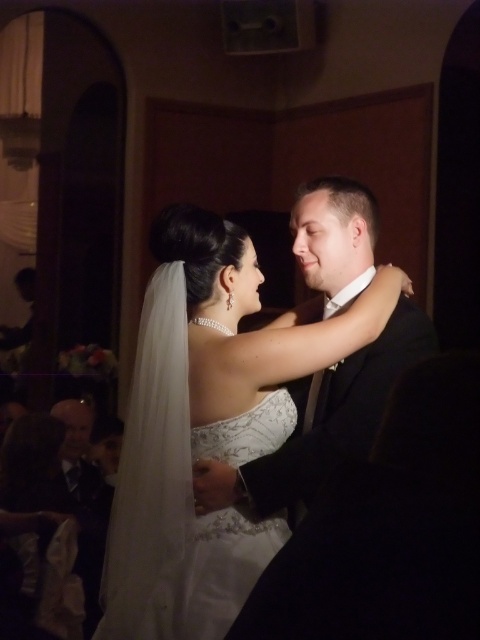
Which is above, white satin dress at center or white lace dress at center?

Positioned higher is white satin dress at center.

Can you confirm if white satin dress at center is smaller than white lace dress at center?

Actually, white satin dress at center might be larger than white lace dress at center.

At what (x,y) coordinates should I click in order to perform the action: click on white satin dress at center. Please return your answer as a coordinate pair (x, y). Looking at the image, I should click on (208, 424).